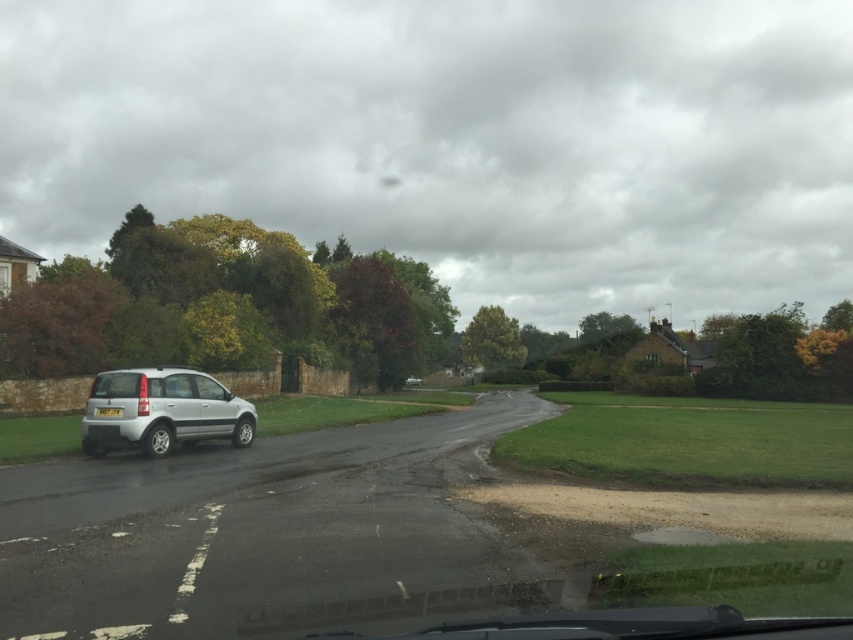
Question: Observing the image, what is the correct spatial positioning of silver metallic car at left in reference to white plastic license plate at center?

Choices:
 (A) above
 (B) below

Answer: (B)

Question: Is silver metallic car at left above white plastic license plate at center?

Choices:
 (A) yes
 (B) no

Answer: (B)

Question: Is silver metallic car at left to the right of white plastic license plate at center from the viewer's perspective?

Choices:
 (A) no
 (B) yes

Answer: (B)

Question: Among these points, which one is farthest from the camera?

Choices:
 (A) (206, 406)
 (B) (120, 413)

Answer: (A)

Question: Which object appears farthest from the camera in this image?

Choices:
 (A) silver metallic car at left
 (B) white plastic license plate at center

Answer: (A)

Question: Among these points, which one is farthest from the camera?

Choices:
 (A) (97, 406)
 (B) (114, 428)

Answer: (A)